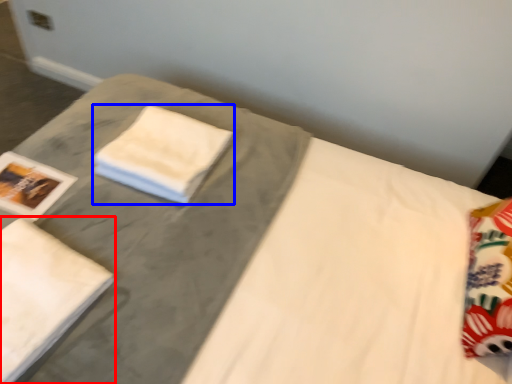
Question: Which point is closer to the camera, bath towel (highlighted by a red box) or cloth (highlighted by a blue box)?

Choices:
 (A) bath towel
 (B) cloth

Answer: (A)